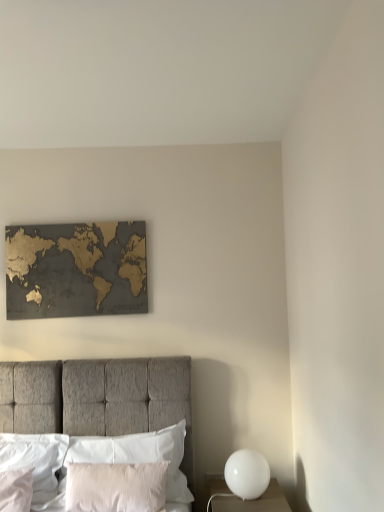
Question: Based on their sizes in the image, would you say pink velvet pillow at lower center, arranged as the second pillow when viewed from the right, is bigger or smaller than white glossy sphere at lower right?

Choices:
 (A) big
 (B) small

Answer: (A)

Question: Is pink velvet pillow at lower center, arranged as the second pillow when viewed from the right, taller or shorter than white glossy sphere at lower right?

Choices:
 (A) short
 (B) tall

Answer: (B)

Question: Which is farther from the white soft pillow at lower left, which is the third pillow from right to left?

Choices:
 (A) white glossy sphere at lower right
 (B) textured gray bed at center
 (C) white satin pillow at lower left, the 4th pillow in the right-to-left sequence
 (D) pink velvet pillow at lower center, arranged as the second pillow when viewed from the right
 (E) white glossy sphere at lower right

Answer: (E)

Question: Which object is the farthest from the textured gray bed at center?

Choices:
 (A) white soft pillow at lower left, which is the third pillow from right to left
 (B) white glossy sphere at lower right
 (C) pink velvet pillow at lower center, which is the 3th pillow from left to right
 (D) silky white pillow at center, the 1th pillow in the right-to-left sequence
 (E) white glossy sphere at lower right

Answer: (B)